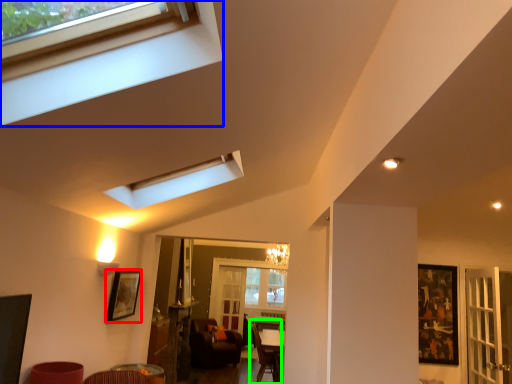
Question: Considering the real-world distances, which object is farthest from picture frame (highlighted by a red box)? window (highlighted by a blue box) or armchair (highlighted by a green box)?

Choices:
 (A) window
 (B) armchair

Answer: (A)